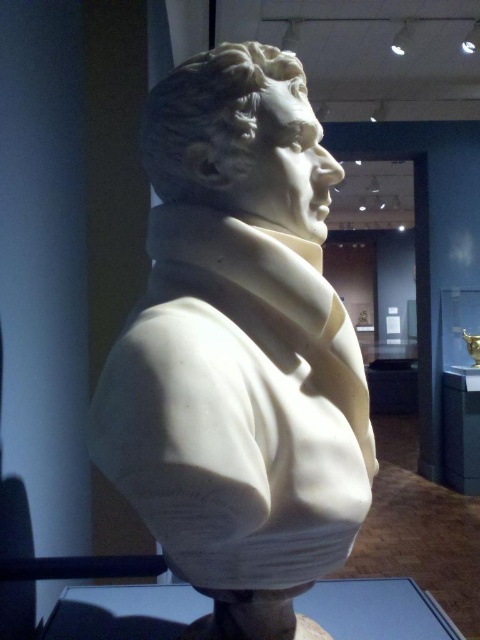
Between point (158, 269) and point (399, 602), which one is positioned behind?

Point (399, 602)

Can you confirm if white marble bust at center is positioned to the left of transparent glass table at lower center?

Indeed, white marble bust at center is positioned on the left side of transparent glass table at lower center.

What do you see at coordinates (239, 349) in the screenshot?
I see `white marble bust at center` at bounding box center [239, 349].

Locate an element on the screen. This screenshot has height=640, width=480. white marble bust at center is located at coordinates (239, 349).